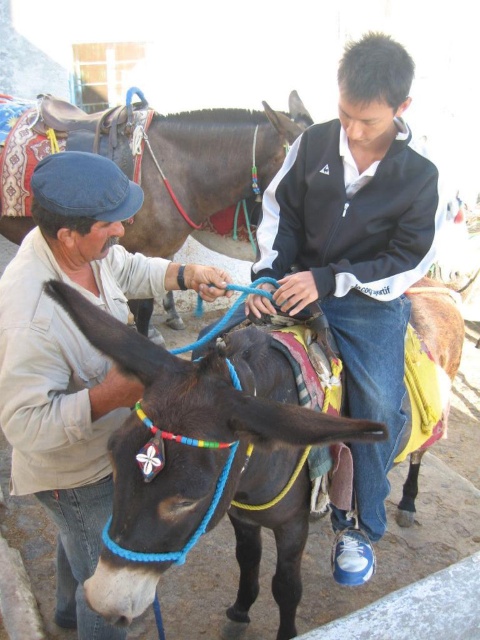
Question: Observing the image, what is the correct spatial positioning of black glossy mule at center in reference to light beige jacket at center?

Choices:
 (A) above
 (B) below

Answer: (B)

Question: Does light beige jacket at center have a smaller size compared to shiny black mule at center?

Choices:
 (A) no
 (B) yes

Answer: (B)

Question: Which of the following is the closest to the observer?

Choices:
 (A) (362, 70)
 (B) (252, 381)
 (C) (68, 326)
 (D) (108, 154)

Answer: (B)

Question: Which point is farther to the camera?

Choices:
 (A) (109, 490)
 (B) (237, 125)
 (C) (381, 419)

Answer: (B)

Question: Does black matte jacket at center have a greater width compared to shiny black mule at center?

Choices:
 (A) no
 (B) yes

Answer: (A)

Question: Which is farther from the black glossy mule at center?

Choices:
 (A) light beige jacket at center
 (B) black matte jacket at center
 (C) shiny black mule at center

Answer: (C)